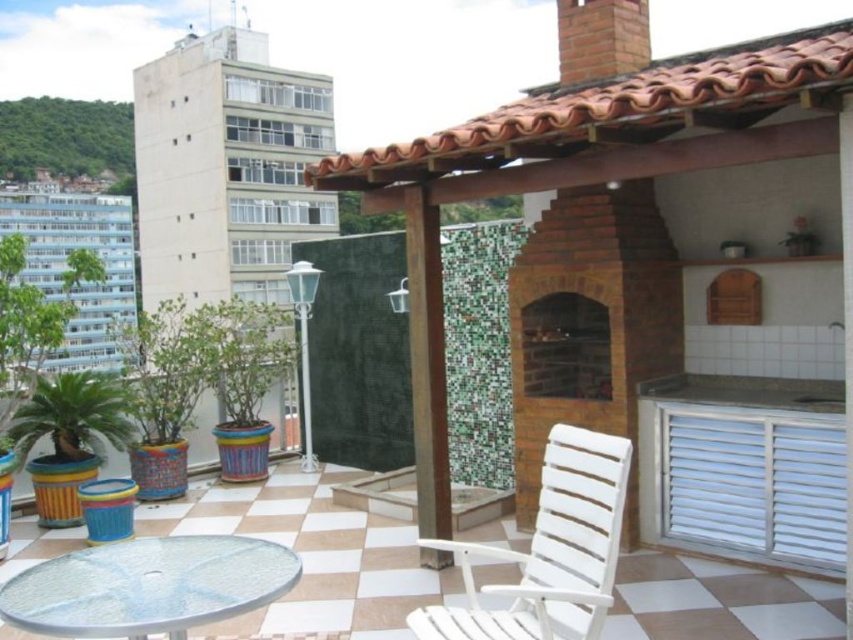
Question: Can you confirm if white plastic chair at center is positioned to the right of transparent glass table at lower left?

Choices:
 (A) no
 (B) yes

Answer: (B)

Question: Which object is farther from the camera taking this photo?

Choices:
 (A) brick fireplace at center
 (B) green matte potted plant at lower left
 (C) transparent glass table at lower left
 (D) white plastic chair at center

Answer: (B)

Question: Which of these objects is positioned closest to the brick fireplace at center?

Choices:
 (A) white plastic chair at center
 (B) brown wood pillar at center
 (C) transparent glass table at lower left
 (D) green matte potted plant at lower left

Answer: (B)

Question: Where is transparent glass table at lower left located in relation to green matte potted plant at lower left in the image?

Choices:
 (A) right
 (B) left

Answer: (A)

Question: Can you confirm if brown wood pillar at center is positioned above green matte potted plant at lower left?

Choices:
 (A) no
 (B) yes

Answer: (B)

Question: Which of the following is the farthest from the observer?

Choices:
 (A) white plastic chair at center
 (B) brick fireplace at center
 (C) transparent glass table at lower left
 (D) brown wood pillar at center

Answer: (B)